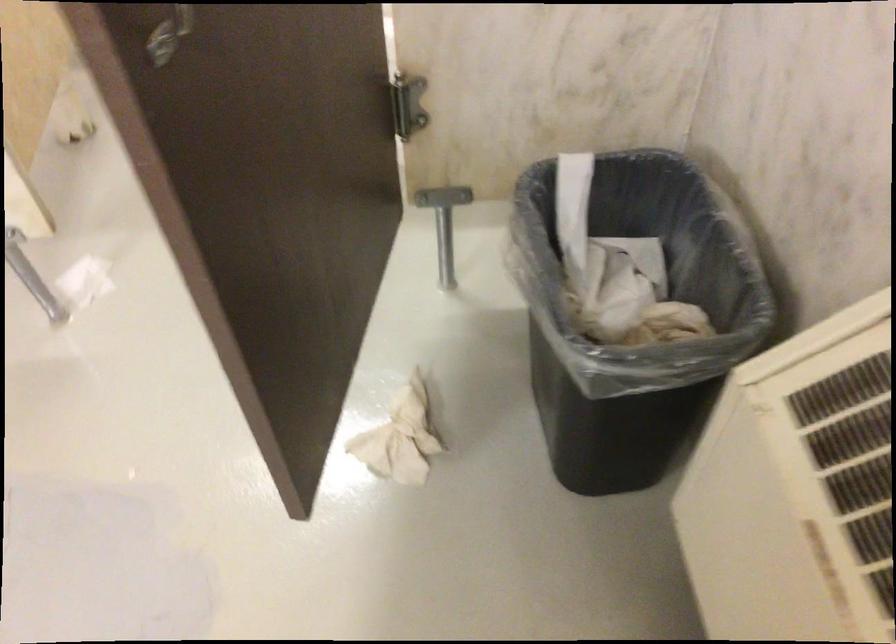
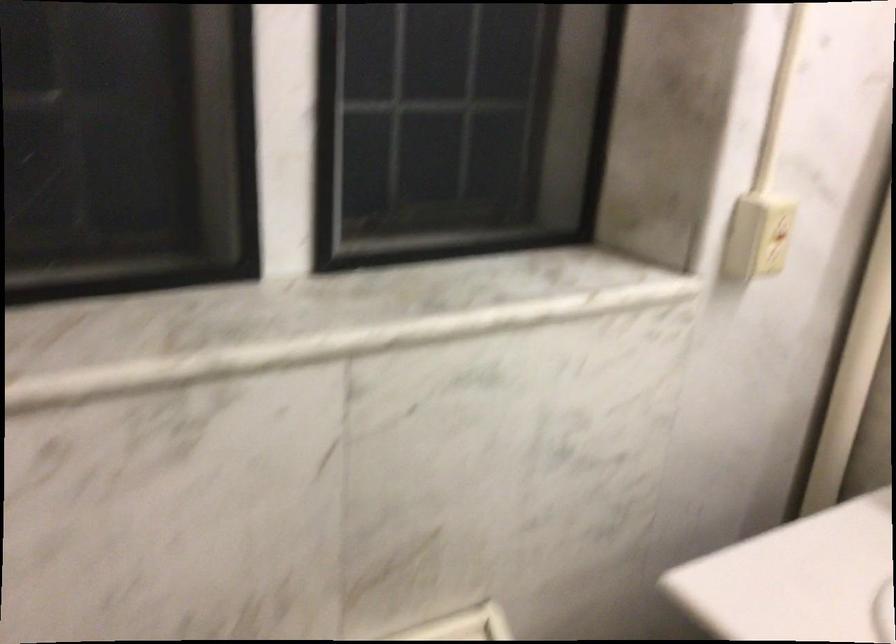
The images are taken continuously from a first-person perspective. In which direction is your viewpoint rotating?

The camera rotated toward right-down.